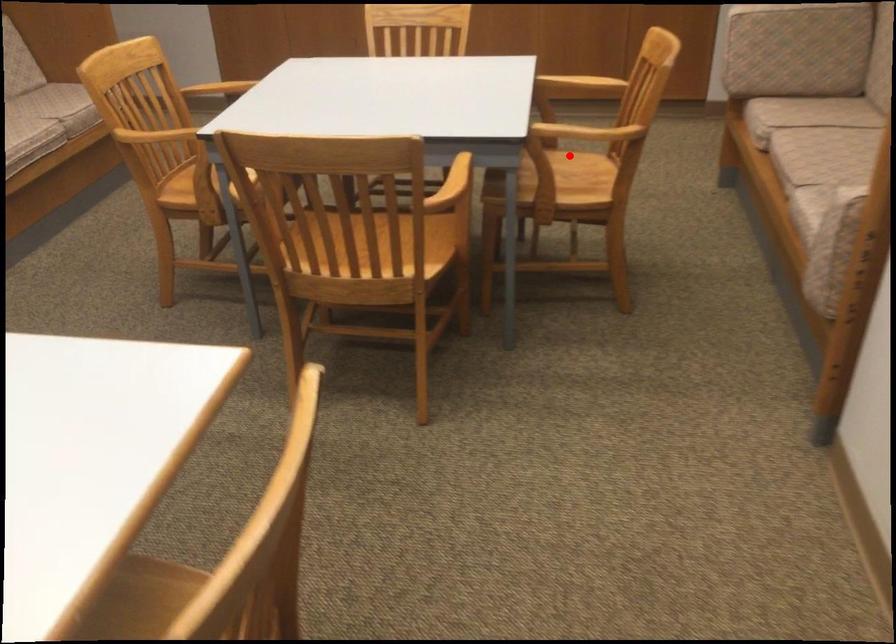
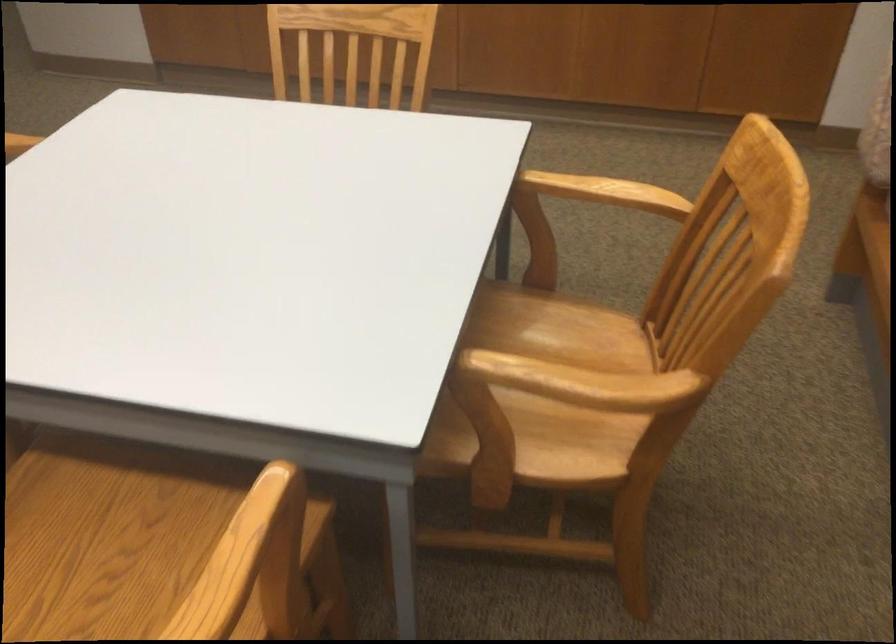
Locate, in the second image, the point that corresponds to the highlighted location in the first image.

(567, 330)